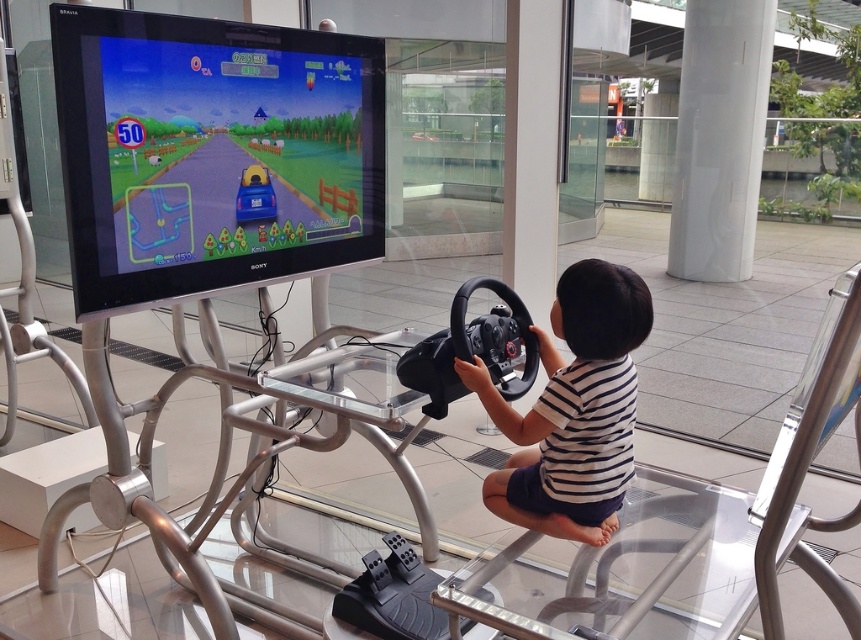
Can you confirm if matte plastic screen at upper left is shorter than white striped shirt at center?

In fact, matte plastic screen at upper left may be taller than white striped shirt at center.

Can you confirm if matte plastic screen at upper left is positioned above white striped shirt at center?

Indeed, matte plastic screen at upper left is positioned over white striped shirt at center.

Locate an element on the screen. The height and width of the screenshot is (640, 861). matte plastic screen at upper left is located at coordinates (212, 152).

This screenshot has width=861, height=640. I want to click on matte plastic screen at upper left, so click(x=212, y=152).

Who is more forward, (189, 291) or (700, 253)?

Point (189, 291) is in front.

Is point (141, 282) closer to camera compared to point (691, 56)?

Yes.

Does point (268, 179) come closer to viewer compared to point (698, 225)?

Yes.

What are the coordinates of `matte plastic screen at upper left` in the screenshot? It's located at (212, 152).

Is point (562, 296) more distant than point (756, 13)?

That is False.

Which of these two, white striped shirt at center or white glossy pillar at upper right, stands taller?

With more height is white glossy pillar at upper right.

Find the location of a particular element. Image resolution: width=861 pixels, height=640 pixels. white striped shirt at center is located at coordinates (573, 410).

You are a GUI agent. You are given a task and a screenshot of the screen. Output one action in this format:
    pyautogui.click(x=<x>, y=<y>)
    Task: Click on the white striped shirt at center
    This screenshot has height=640, width=861.
    Given the screenshot: What is the action you would take?
    pyautogui.click(x=573, y=410)